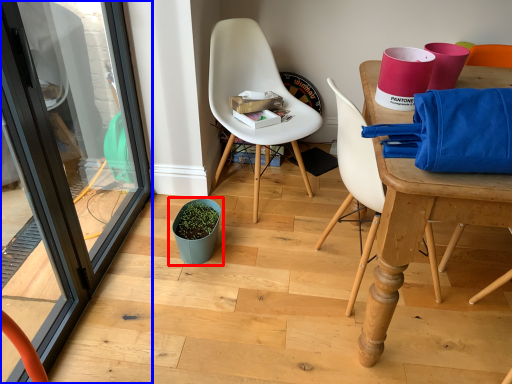
Question: Among these objects, which one is nearest to the camera, flowerpot (highlighted by a red box) or screen door (highlighted by a blue box)?

Choices:
 (A) flowerpot
 (B) screen door

Answer: (B)